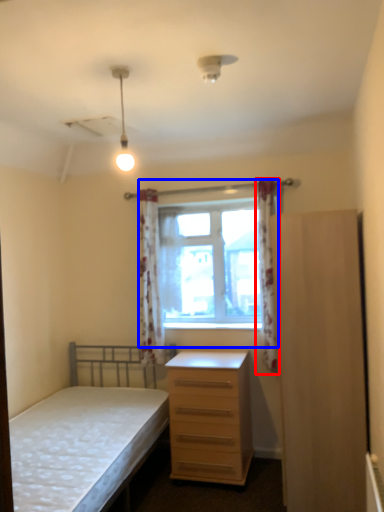
Question: Which object is closer to the camera taking this photo, curtain (highlighted by a red box) or window (highlighted by a blue box)?

Choices:
 (A) curtain
 (B) window

Answer: (A)